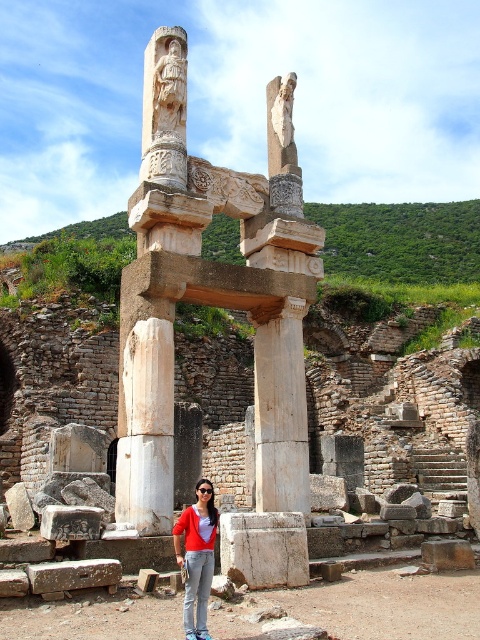
Does white stone column at center appear under matte red sweater at center?

Actually, white stone column at center is above matte red sweater at center.

The height and width of the screenshot is (640, 480). I want to click on white stone column at center, so click(x=212, y=291).